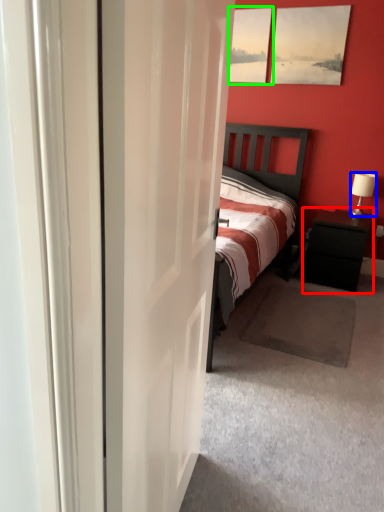
Question: Estimate the real-world distances between objects in this image. Which object is closer to nightstand (highlighted by a red box), lamp (highlighted by a blue box) or picture frame (highlighted by a green box)?

Choices:
 (A) lamp
 (B) picture frame

Answer: (A)